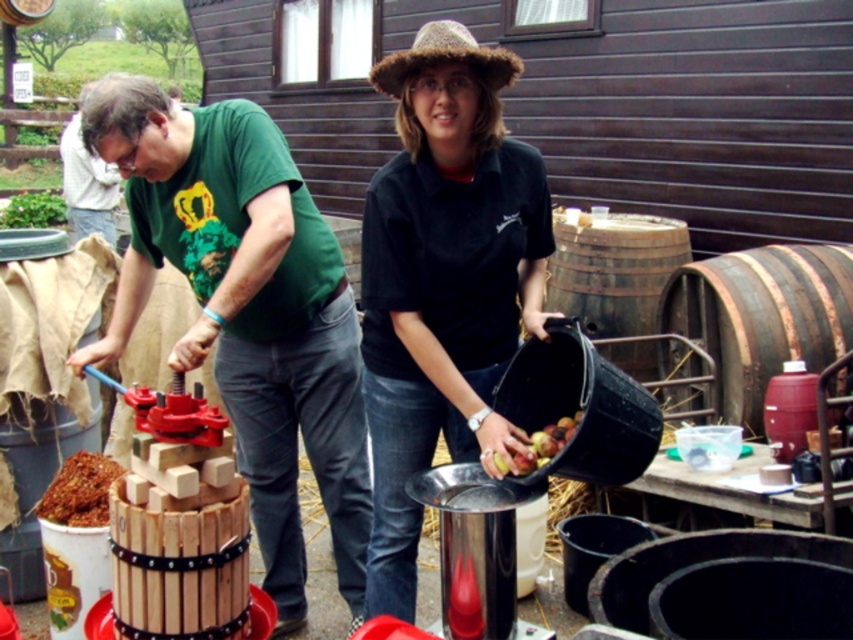
Question: Among these objects, which one is nearest to the camera?

Choices:
 (A) brown wooden barrel at right
 (B) crumbly brown cake at lower left
 (C) wooden barrel at right
 (D) ripe apple at center

Answer: (D)

Question: Is wooden barrel at center in front of crumbly brown cake at lower left?

Choices:
 (A) no
 (B) yes

Answer: (B)

Question: Which object is farther from the camera taking this photo?

Choices:
 (A) wooden barrel at right
 (B) wooden barrel at center
 (C) ripe apple at center
 (D) crumbly brown cake at lower left

Answer: (A)

Question: Which point appears closest to the camera in this image?

Choices:
 (A) (68, 522)
 (B) (648, 262)
 (C) (561, 429)
 (D) (161, 225)

Answer: (C)

Question: Where is brown wooden barrel at right located in relation to crumbly brown cake at lower left in the image?

Choices:
 (A) right
 (B) left

Answer: (A)

Question: Is brown wooden barrel at right closer to the viewer compared to wooden barrel at right?

Choices:
 (A) no
 (B) yes

Answer: (B)